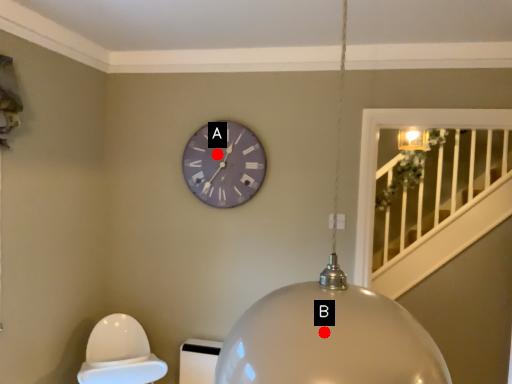
Question: Two points are circled on the image, labeled by A and B beside each circle. Which point is closer to the camera?

Choices:
 (A) A is closer
 (B) B is closer

Answer: (B)